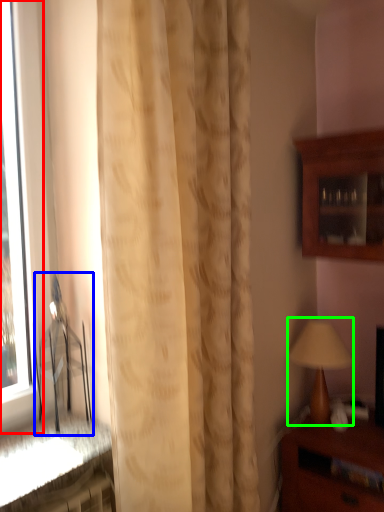
Question: Which is farther away from window (highlighted by a red box)? chair (highlighted by a blue box) or table lamp (highlighted by a green box)?

Choices:
 (A) chair
 (B) table lamp

Answer: (B)